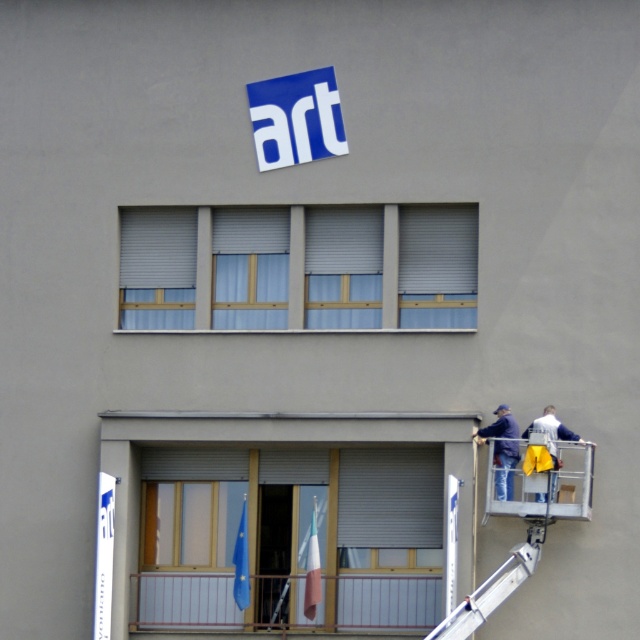
Question: Is blue fabric at upper center bigger than light blue fabric at center?

Choices:
 (A) yes
 (B) no

Answer: (B)

Question: Which object is positioned farthest from the yellow fabric at lower right?

Choices:
 (A) white matte window at center
 (B) light blue fabric at center
 (C) blue fabric at upper center
 (D) gray matte blinds at upper left

Answer: (D)

Question: Among these points, which one is nearest to the camera?

Choices:
 (A) (497, 492)
 (B) (164, 260)
 (C) (516, 492)
 (D) (198, 308)

Answer: (A)

Question: Which object appears closest to the camera in this image?

Choices:
 (A) white matte window at center
 (B) gray matte blinds at upper left
 (C) yellow fabric at lower right
 (D) blue denim jacket at lower right

Answer: (C)

Question: Is light blue fabric at center to the right of blue denim jacket at lower right from the viewer's perspective?

Choices:
 (A) yes
 (B) no

Answer: (B)

Question: Can you confirm if blue fabric window at center is smaller than yellow fabric at lower center?

Choices:
 (A) no
 (B) yes

Answer: (B)